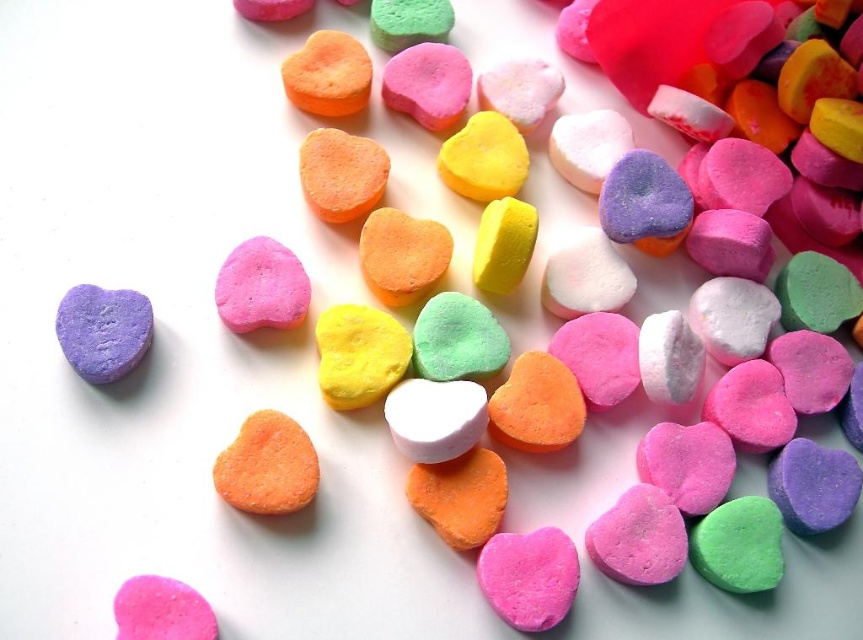
You are a child who wants to pick up two candies located at point (217, 312) and another candy at point 0.652, 0.781. The child can reach 1.2 meters. Can the child reach both candies?

The two candies at point (217, 312) and point 0.652, 0.781 are 1.30 meters apart. Since the child can only reach 1.2 meters, they cannot reach both candies.

You are organizing a Valentine gift box and need to place the matte purple heart at left precisely. According to the coordinates provided, where should you position it?

The matte purple heart at left should be positioned at coordinates point (104, 330) as specified.